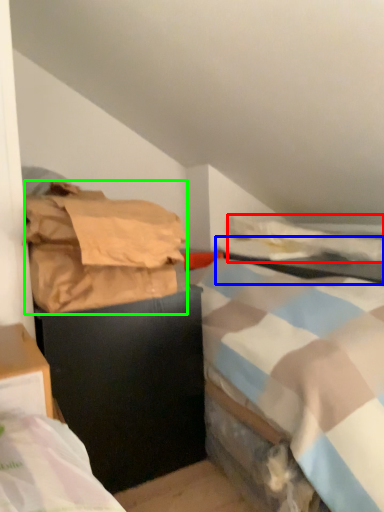
Question: Which object is positioned farthest from blanket (highlighted by a red box)? Select from table (highlighted by a blue box) and material (highlighted by a green box).

Choices:
 (A) table
 (B) material

Answer: (B)